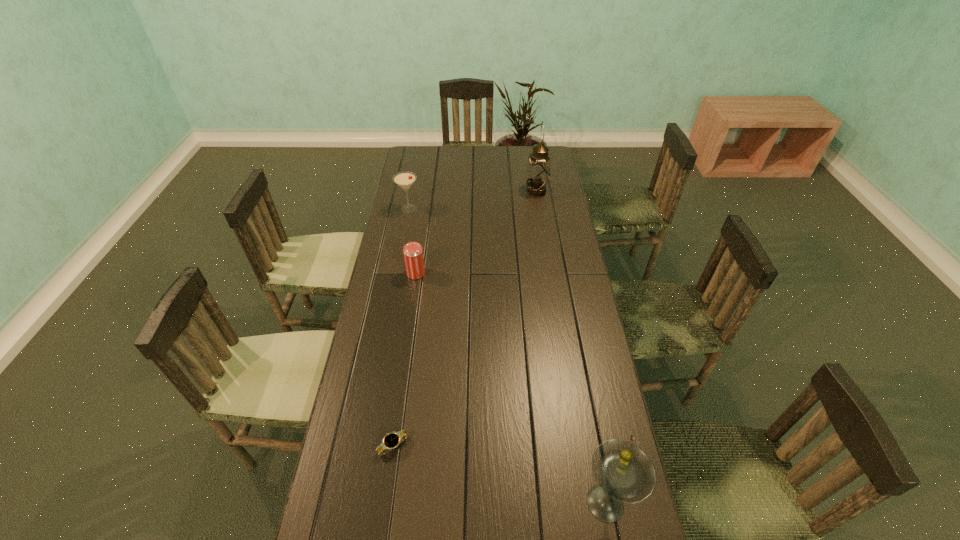
Where is `free region at the far edge of the desktop`? The width and height of the screenshot is (960, 540). free region at the far edge of the desktop is located at coordinates (470, 148).

In the image, there is a desktop. Where is `vacant space at the left edge`? vacant space at the left edge is located at coordinates (430, 180).

This screenshot has height=540, width=960. In the image, there is a desktop. Identify the location of vacant space at the right edge. (559, 421).

Find the location of a particular element. The image size is (960, 540). vacant space in between the shorter martini and the farthest object is located at coordinates (472, 200).

Image resolution: width=960 pixels, height=540 pixels. In order to click on free space between the shorter martini and the third nearest object in this screenshot , I will do `click(413, 241)`.

This screenshot has height=540, width=960. Find the location of `vacant space that is in between the second nearest object and the third tallest object`. vacant space that is in between the second nearest object and the third tallest object is located at coordinates (401, 327).

Locate an element on the screen. This screenshot has width=960, height=540. empty space between the third tallest object and the right martini is located at coordinates (507, 356).

Find the location of a particular element. The width and height of the screenshot is (960, 540). blank region between the second shortest object and the second nearest object is located at coordinates (405, 360).

Image resolution: width=960 pixels, height=540 pixels. Identify the location of vacant space that's between the shorter martini and the beer can. (413, 241).

Identify the location of free area in between the nearer martini and the left martini. (507, 356).